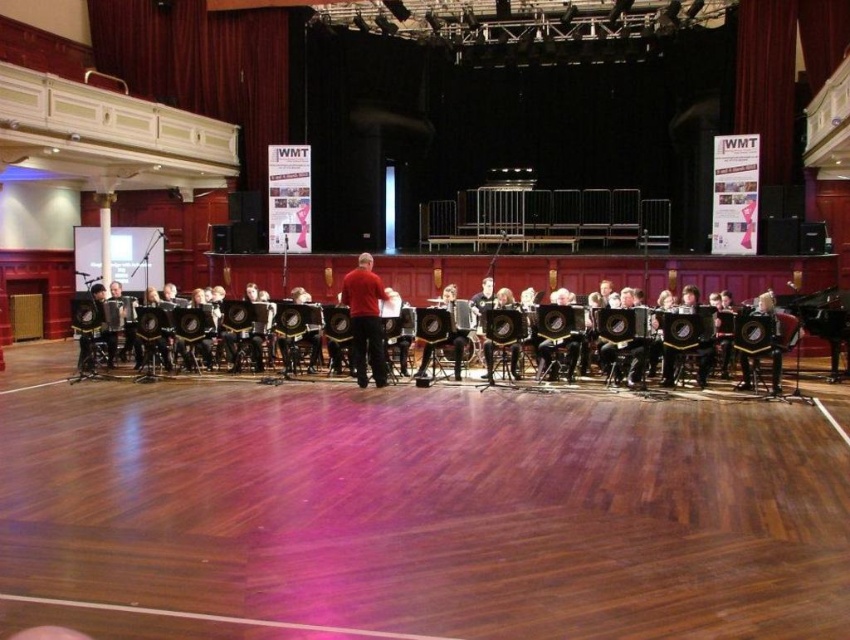
Question: Which point appears closest to the camera in this image?

Choices:
 (A) (503, 336)
 (B) (354, 364)

Answer: (A)

Question: Is wooden floor at center wider than black leather accordion at center?

Choices:
 (A) no
 (B) yes

Answer: (A)

Question: Which of these objects is positioned farthest from the black leather accordion at center?

Choices:
 (A) wooden floor at center
 (B) matte red shirt at center

Answer: (A)

Question: Which point is closer to the camera taking this photo?

Choices:
 (A) (357, 262)
 (B) (530, 324)

Answer: (B)

Question: Can you confirm if wooden floor at center is smaller than black leather accordion at center?

Choices:
 (A) yes
 (B) no

Answer: (A)

Question: Observing the image, what is the correct spatial positioning of wooden floor at center in reference to black leather accordion at center?

Choices:
 (A) above
 (B) below

Answer: (B)